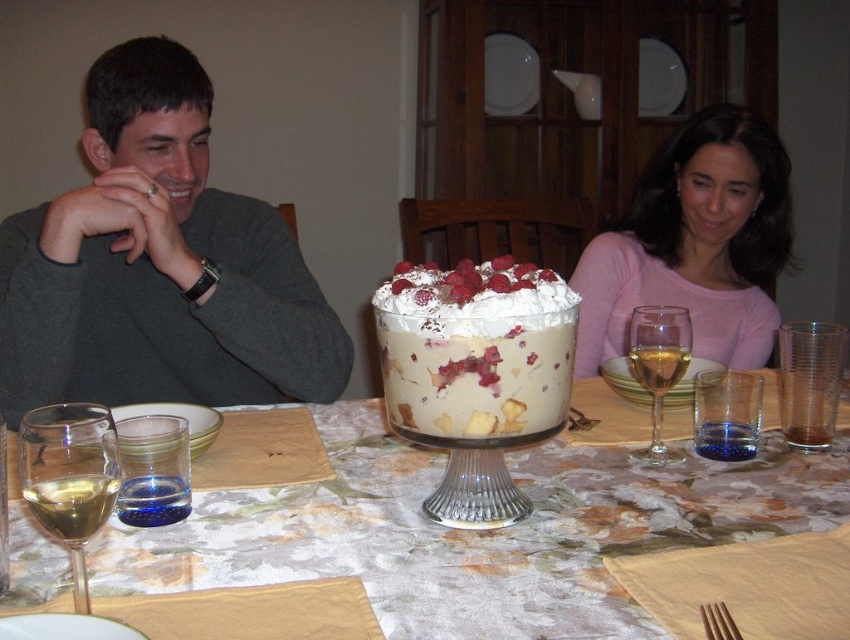
Can you confirm if pink matte sweater at upper right is positioned to the right of clear glass wine glass at lower left?

Correct, you'll find pink matte sweater at upper right to the right of clear glass wine glass at lower left.

Is point (752, 182) farther from camera compared to point (37, 436)?

That is True.

Measure the distance between point (x=744, y=344) and camera.

Point (x=744, y=344) is 4.92 feet from camera.

You are a GUI agent. You are given a task and a screenshot of the screen. Output one action in this format:
    pyautogui.click(x=<x>, y=<y>)
    Task: Click on the pink matte sweater at upper right
    This screenshot has height=640, width=850.
    Given the screenshot: What is the action you would take?
    pyautogui.click(x=695, y=243)

Is gray matte sweater at upper left smaller than pink matte sweater at upper right?

Actually, gray matte sweater at upper left might be larger than pink matte sweater at upper right.

Does gray matte sweater at upper left appear under pink matte sweater at upper right?

Yes, gray matte sweater at upper left is below pink matte sweater at upper right.

Who is more forward, (68, 390) or (735, 280)?

Positioned in front is point (68, 390).

The image size is (850, 640). In order to click on gray matte sweater at upper left in this screenshot , I will do `click(157, 266)`.

Who is taller, pink matte sweater at upper right or clear glass wine glass at center right?

pink matte sweater at upper right is taller.

Is pink matte sweater at upper right above clear glass wine glass at center right?

Yes, pink matte sweater at upper right is above clear glass wine glass at center right.

Does point (703, 168) come farther from viewer compared to point (658, 412)?

Yes.

Locate an element on the screen. The image size is (850, 640). pink matte sweater at upper right is located at coordinates (695, 243).